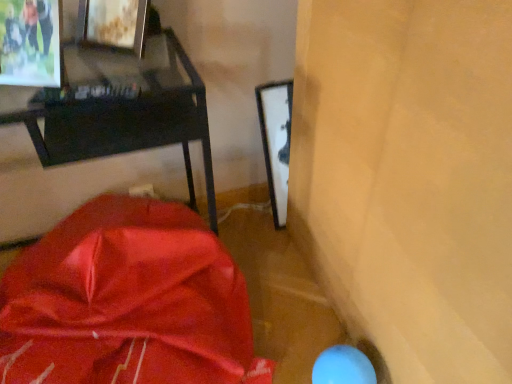
Question: Does matte black desk at upper left have a smaller size compared to satin red blanket at lower left?

Choices:
 (A) yes
 (B) no

Answer: (A)

Question: Considering the relative sizes of matte black desk at upper left and satin red blanket at lower left in the image provided, is matte black desk at upper left thinner than satin red blanket at lower left?

Choices:
 (A) no
 (B) yes

Answer: (B)

Question: Is matte black desk at upper left wider than satin red blanket at lower left?

Choices:
 (A) no
 (B) yes

Answer: (A)

Question: Is matte black desk at upper left located outside satin red blanket at lower left?

Choices:
 (A) no
 (B) yes

Answer: (A)

Question: From a real-world perspective, is matte black desk at upper left below satin red blanket at lower left?

Choices:
 (A) yes
 (B) no

Answer: (B)

Question: From the image's perspective, is matte black desk at upper left under satin red blanket at lower left?

Choices:
 (A) yes
 (B) no

Answer: (B)

Question: Considering the relative sizes of matte black desk at upper left and metallic silver picture frame at upper left in the image provided, is matte black desk at upper left thinner than metallic silver picture frame at upper left?

Choices:
 (A) no
 (B) yes

Answer: (A)

Question: Is matte black desk at upper left wider than metallic silver picture frame at upper left?

Choices:
 (A) no
 (B) yes

Answer: (B)

Question: From the image's perspective, does matte black desk at upper left appear lower than metallic silver picture frame at upper left?

Choices:
 (A) yes
 (B) no

Answer: (A)

Question: Could you tell me if matte black desk at upper left is turned towards metallic silver picture frame at upper left?

Choices:
 (A) no
 (B) yes

Answer: (A)

Question: From a real-world perspective, is matte black desk at upper left under metallic silver picture frame at upper left?

Choices:
 (A) yes
 (B) no

Answer: (A)

Question: Are matte black desk at upper left and metallic silver picture frame at upper left beside each other?

Choices:
 (A) no
 (B) yes

Answer: (A)

Question: Is satin red blanket at lower left at the left side of metallic silver picture frame at upper left?

Choices:
 (A) yes
 (B) no

Answer: (B)